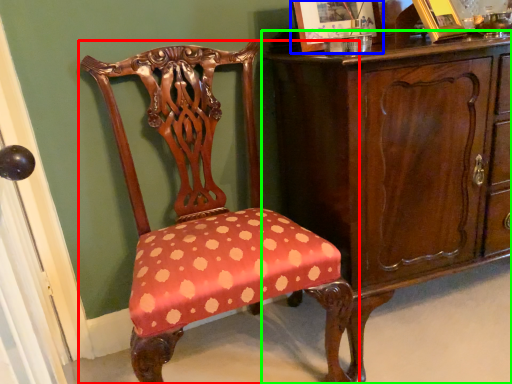
Question: Estimate the real-world distances between objects in this image. Which object is closer to chair (highlighted by a red box), picture frame (highlighted by a blue box) or chest of drawers (highlighted by a green box)?

Choices:
 (A) picture frame
 (B) chest of drawers

Answer: (B)